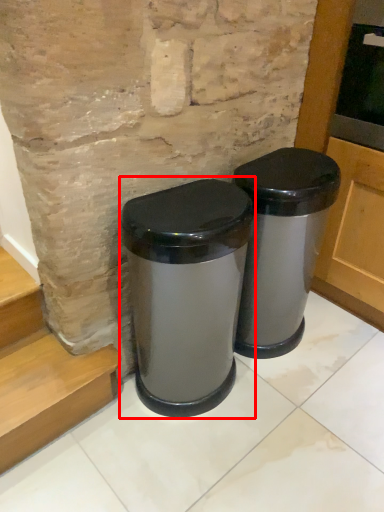
Question: From the image's perspective, what is the correct spatial relationship of waste container (annotated by the red box) in relation to waste container?

Choices:
 (A) below
 (B) above

Answer: (A)